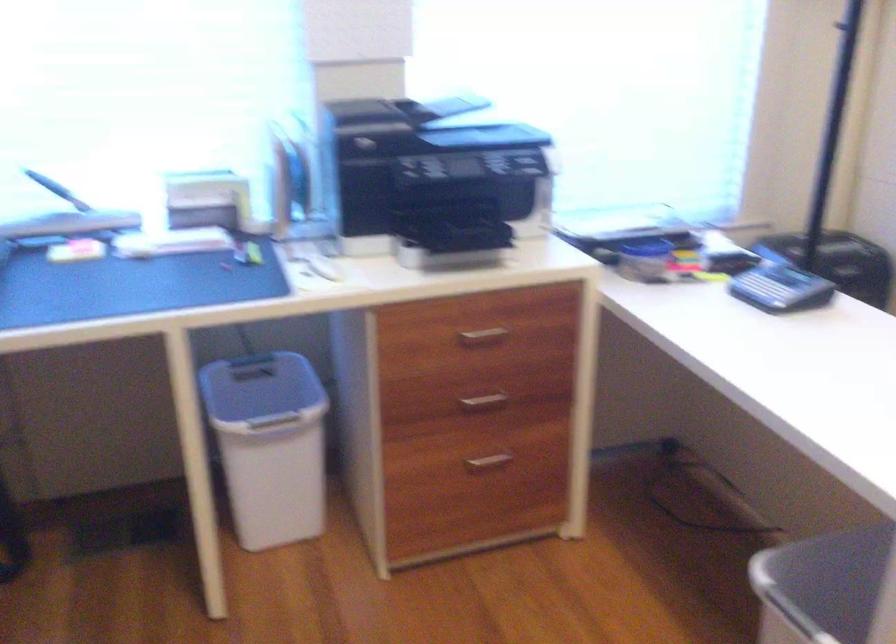
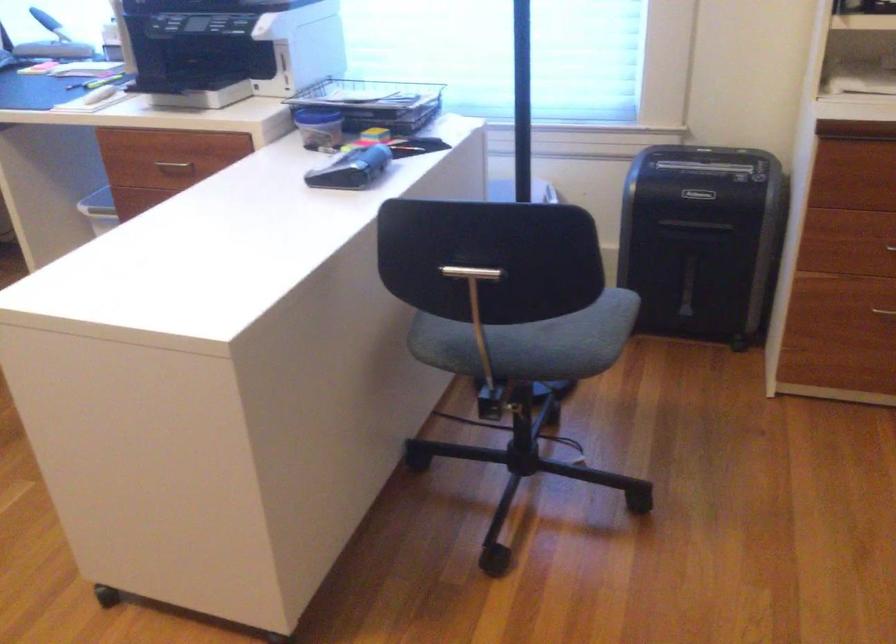
Question: I am providing you with two images of the same scene from different viewpoints. After the viewpoint changes to image2, which objects are now occluded?

Choices:
 (A) silver drawer handle
 (B) chair sitting surface
 (C) light blue box
 (D) black tape dispenser

Answer: (A)